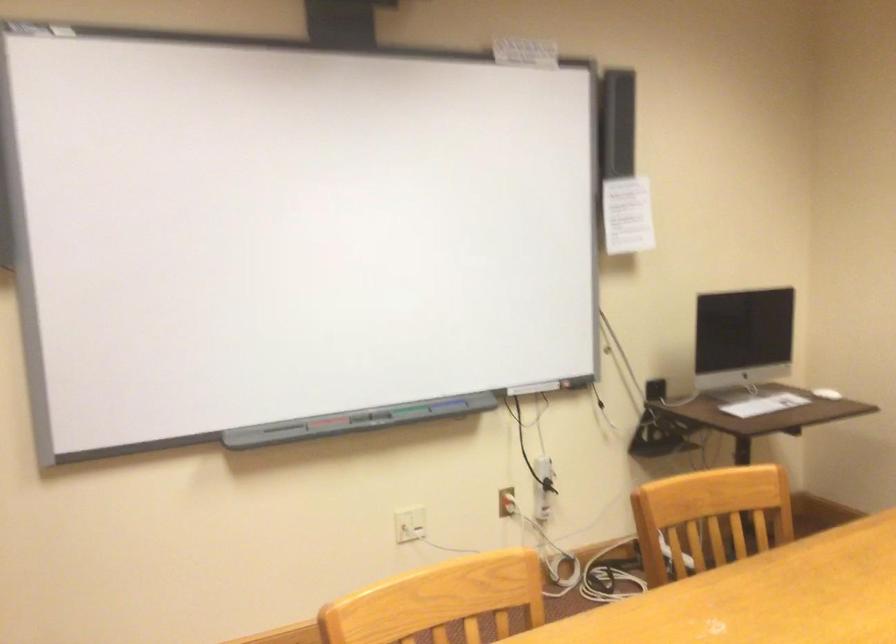
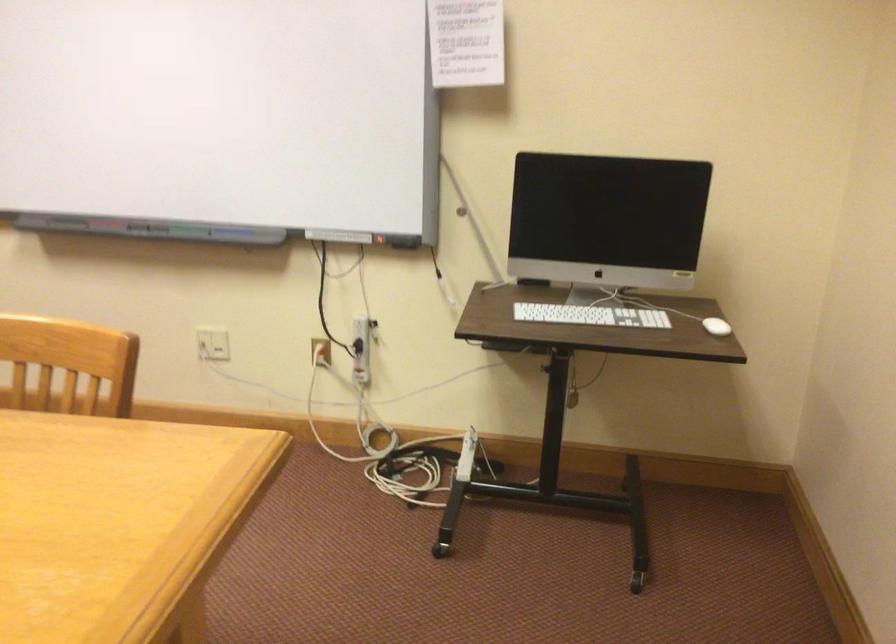
Locate, in the second image, the point that corresponds to point 331,426 in the first image.

(100, 225)